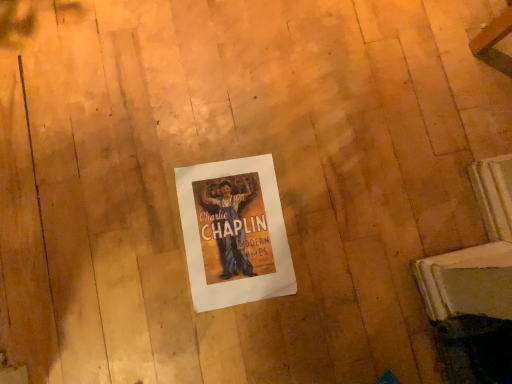
At what (x,y) coordinates should I click in order to perform the action: click on blank space to the left of white paper poster at center. Please return your answer as a coordinate pair (x, y). This screenshot has width=512, height=384. Looking at the image, I should click on (131, 195).